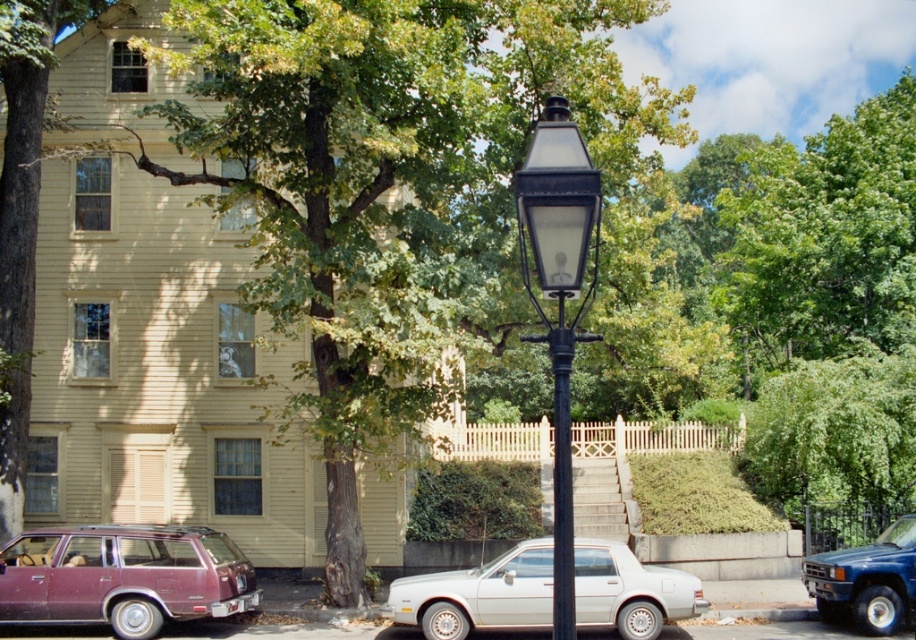
You are a pedestrian standing on the sidewalk and want to cross the street to the yellow house. There is a green leafy tree at center and a maroon matte station wagon at lower left in your view. Which object is closer to you as you stand on the sidewalk?

The green leafy tree at center is closer to you because it is in front of the maroon matte station wagon at lower left, indicating it is nearer to your position on the sidewalk.

You are a pedestrian standing on the sidewalk and want to walk to the black glass street light at center. There is a maroon matte station wagon at lower left blocking your path. Can you walk around it? Explain why.

The maroon matte station wagon at lower left is further to the viewer than the black glass street light at center, so the station wagon is closer to you. You can walk around it to reach the street light.